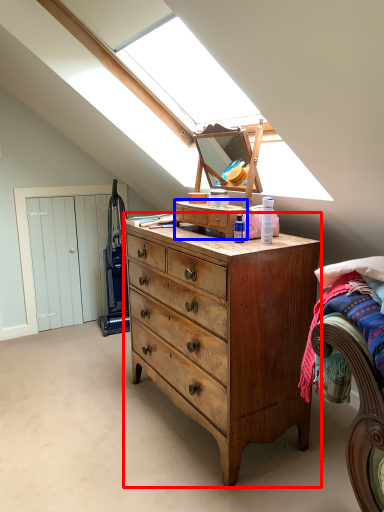
Question: Which of the following is the closest to the observer, chest of drawers (highlighted by a red box) or cabinetry (highlighted by a blue box)?

Choices:
 (A) chest of drawers
 (B) cabinetry

Answer: (A)